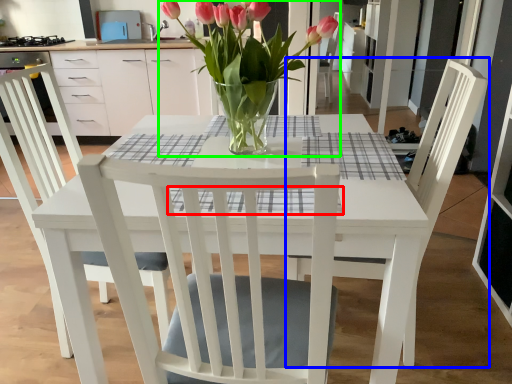
Question: Considering the real-world distances, which object is farthest from plaid (highlighted by a red box)? chair (highlighted by a blue box) or houseplant (highlighted by a green box)?

Choices:
 (A) chair
 (B) houseplant

Answer: (A)